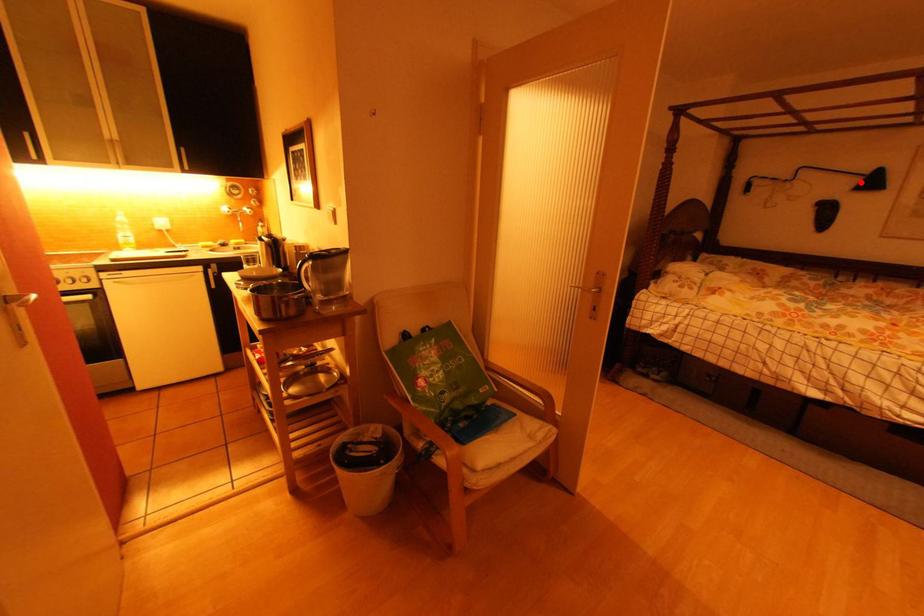
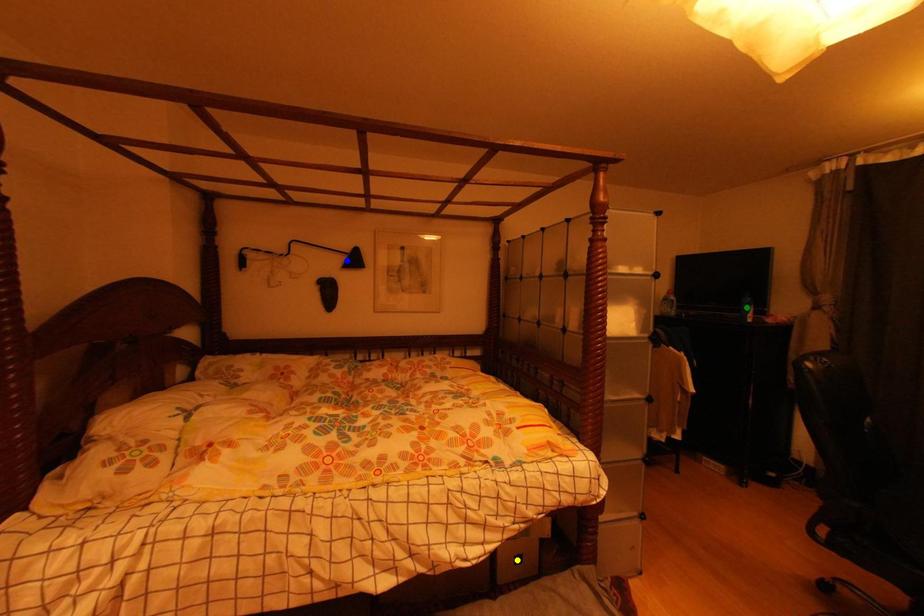
Question: I am providing you with two images of the same scene from different viewpoints. A red point is marked on the first image. You are given multiple points on the second image. Which mark in image 2 goes with the point in image 1?

Choices:
 (A) green point
 (B) yellow point
 (C) blue point

Answer: (C)